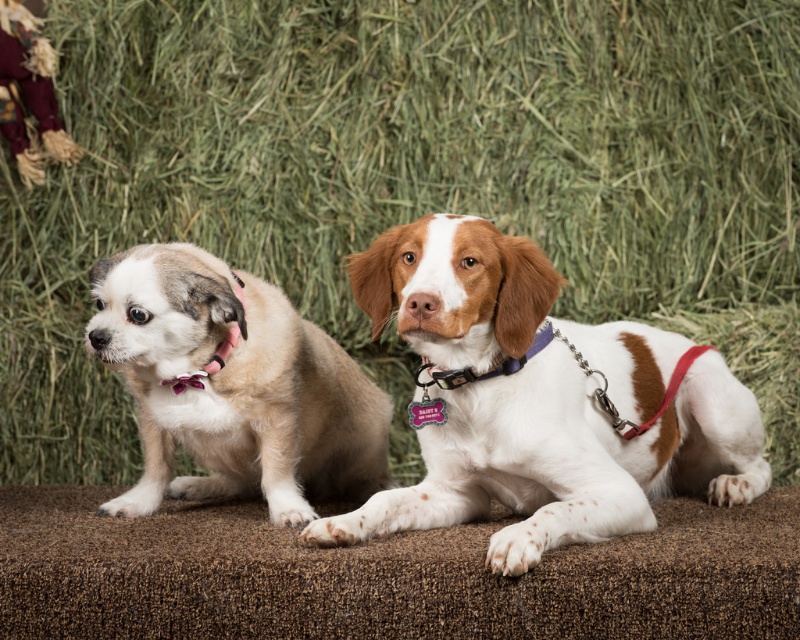
Question: Is brown and white fur at center positioned in front of light brown fur at left?

Choices:
 (A) no
 (B) yes

Answer: (B)

Question: Which object appears closest to the camera in this image?

Choices:
 (A) brown and white fur at center
 (B) light brown fur at left

Answer: (A)

Question: Does brown and white fur at center appear on the right side of light brown fur at left?

Choices:
 (A) yes
 (B) no

Answer: (A)

Question: Does brown and white fur at center have a greater width compared to light brown fur at left?

Choices:
 (A) no
 (B) yes

Answer: (B)

Question: Which of the following is the farthest from the observer?

Choices:
 (A) (584, 433)
 (B) (204, 486)

Answer: (B)